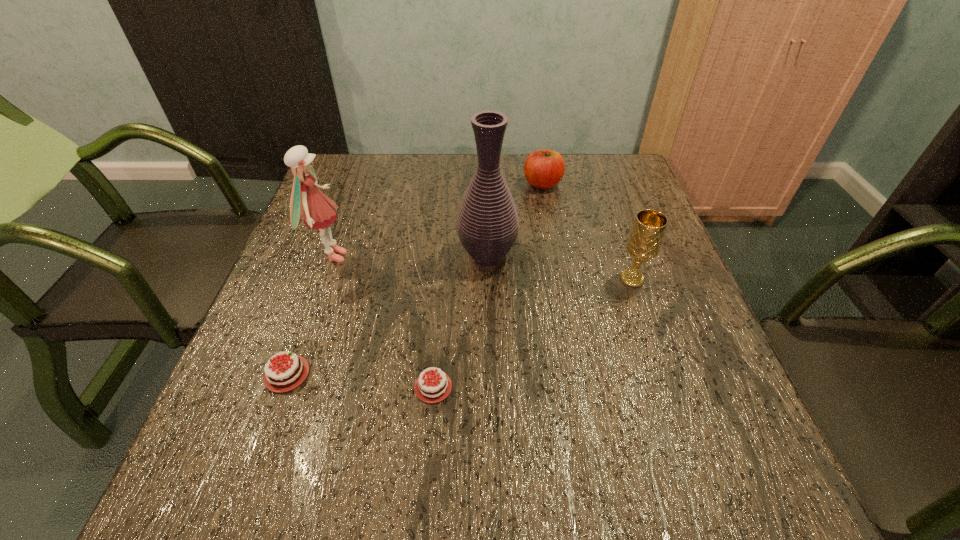
This screenshot has width=960, height=540. Find the location of `free space between the fourth shortest object and the fifth shortest object`. free space between the fourth shortest object and the fifth shortest object is located at coordinates (482, 267).

Identify the location of empty location between the fourth tallest object and the shorter chocolate cake. (488, 285).

Identify the location of unoccupied area between the doll and the tallest object. The width and height of the screenshot is (960, 540). (410, 256).

The height and width of the screenshot is (540, 960). Find the location of `unoccupied position between the left chocolate cake and the third tallest object`. unoccupied position between the left chocolate cake and the third tallest object is located at coordinates (460, 326).

Identify which object is located as the fourth nearest to the shorter chocolate cake. Please provide its 2D coordinates. Your answer should be formatted as a tuple, i.e. [(x, y)], where the tuple contains the x and y coordinates of a point satisfying the conditions above.

[(644, 242)]

Where is `object that can be found as the closest to the doll`? The image size is (960, 540). object that can be found as the closest to the doll is located at coordinates (282, 376).

Identify the location of free point that satisfies the following two spatial constraints: 1. on the front side of the vase; 2. on the front-facing side of the fifth shortest object. (488, 256).

I want to click on vacant space that satisfies the following two spatial constraints: 1. on the front side of the apple; 2. on the front-facing side of the fifth shortest object, so [x=556, y=256].

Identify the location of free space that satisfies the following two spatial constraints: 1. on the front side of the rightmost object; 2. on the left side of the apple. The image size is (960, 540). (560, 279).

Identify the location of vacant point that satisfies the following two spatial constraints: 1. on the front side of the left chocolate cake; 2. on the right side of the shorter chocolate cake. The height and width of the screenshot is (540, 960). (282, 387).